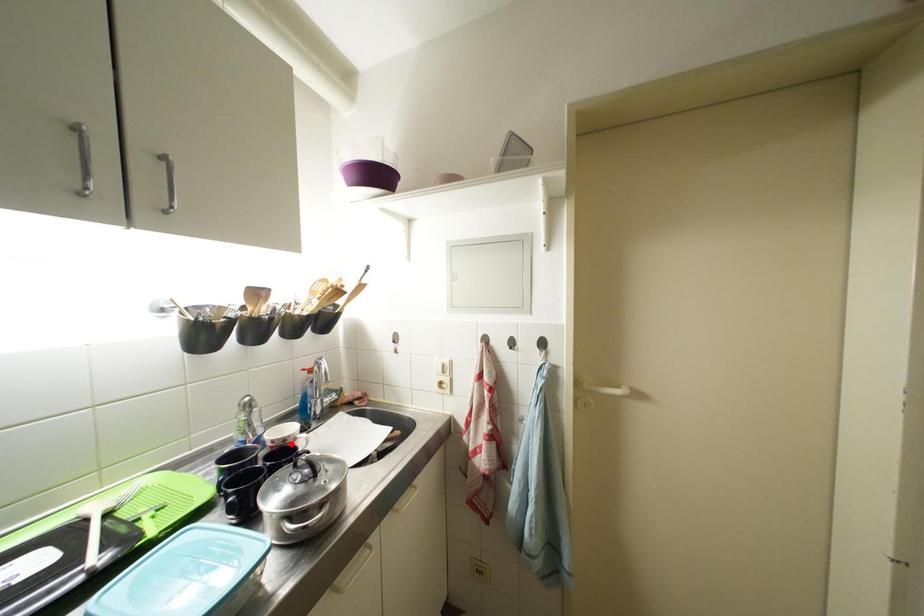
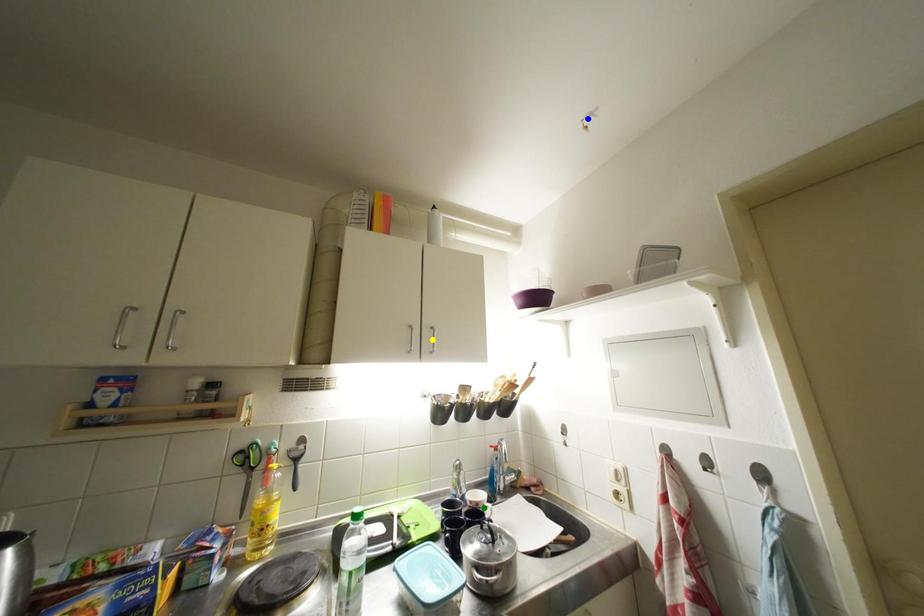
Question: I am providing you with two images of the same scene from different viewpoints. A red point is marked on the first image. You are given multiple points on the second image. Which spot in image 2 lines up with the point in image 1?

Choices:
 (A) green point
 (B) yellow point
 (C) blue point

Answer: (A)